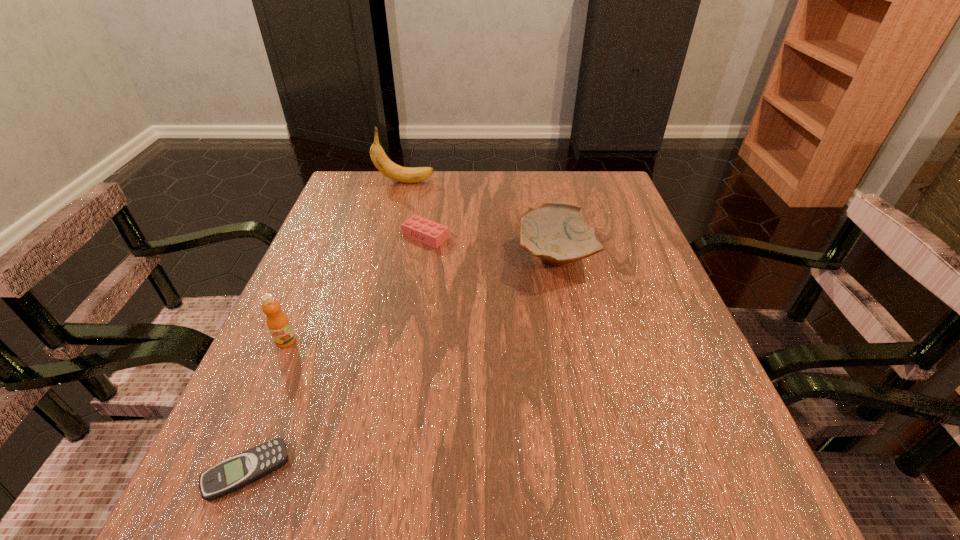
The width and height of the screenshot is (960, 540). I want to click on free space that is in between the third tallest object and the Lego, so click(x=491, y=247).

Find the location of `free space that is in between the pottery and the fourth tallest object`. free space that is in between the pottery and the fourth tallest object is located at coordinates (491, 247).

At what (x,y) coordinates should I click in order to perform the action: click on vacant point located between the second tallest object and the beeper. Please return your answer as a coordinate pair (x, y). The height and width of the screenshot is (540, 960). Looking at the image, I should click on (266, 406).

The width and height of the screenshot is (960, 540). I want to click on vacant region between the second shortest object and the second nearest object, so click(x=356, y=289).

Where is `free space between the fourth tallest object and the third tallest object`? free space between the fourth tallest object and the third tallest object is located at coordinates (491, 247).

Where is `free spot between the nearest object and the pottery`? This screenshot has width=960, height=540. free spot between the nearest object and the pottery is located at coordinates (400, 364).

I want to click on free space between the shortest object and the farthest object, so click(x=326, y=327).

Choose which object is the fourth nearest neighbor to the nearest object. Please provide its 2D coordinates. Your answer should be formatted as a tuple, i.e. [(x, y)], where the tuple contains the x and y coordinates of a point satisfying the conditions above.

[(388, 168)]

Where is `object that is the closest to the banana`? The width and height of the screenshot is (960, 540). object that is the closest to the banana is located at coordinates (420, 229).

This screenshot has height=540, width=960. Identify the location of free space that satisfies the following two spatial constraints: 1. on the front side of the Lego; 2. on the left side of the pottery. (422, 256).